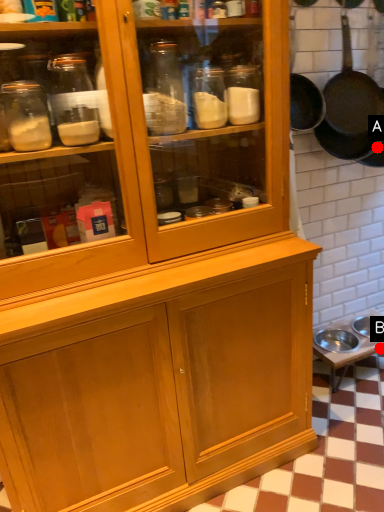
Question: Two points are circled on the image, labeled by A and B beside each circle. Among these points, which one is farthest from the camera?

Choices:
 (A) A is further
 (B) B is further

Answer: (B)